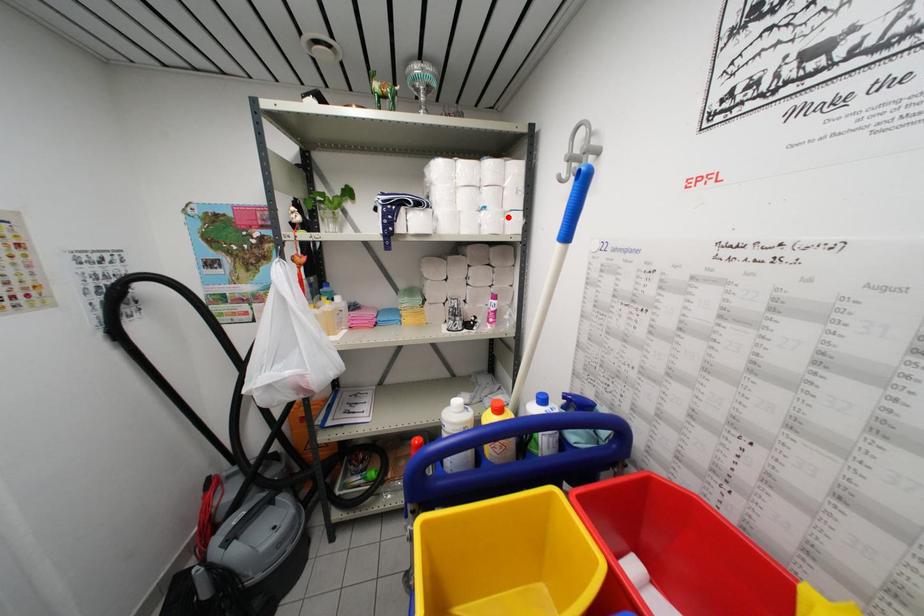
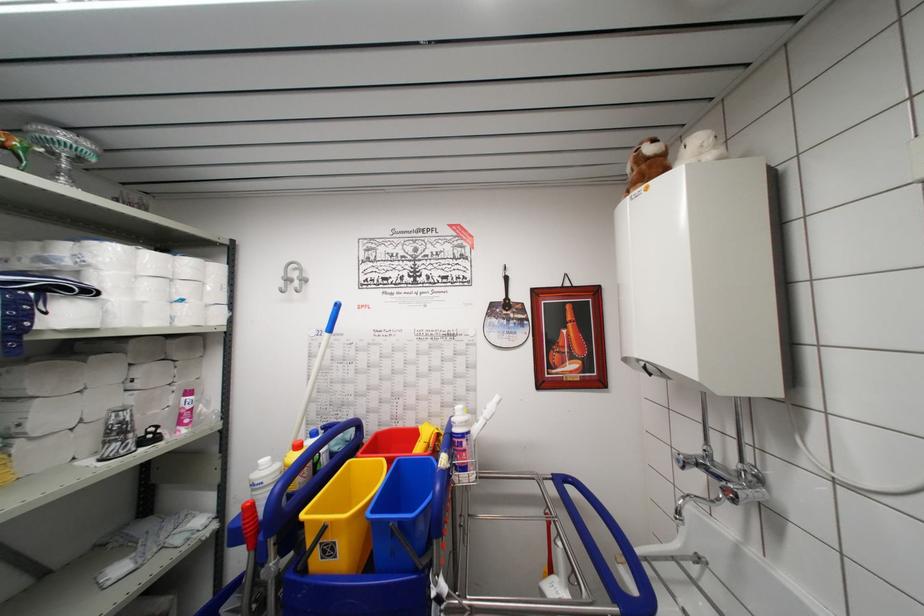
In the second image, find the point that corresponds to the highlighted location in the first image.

(211, 310)